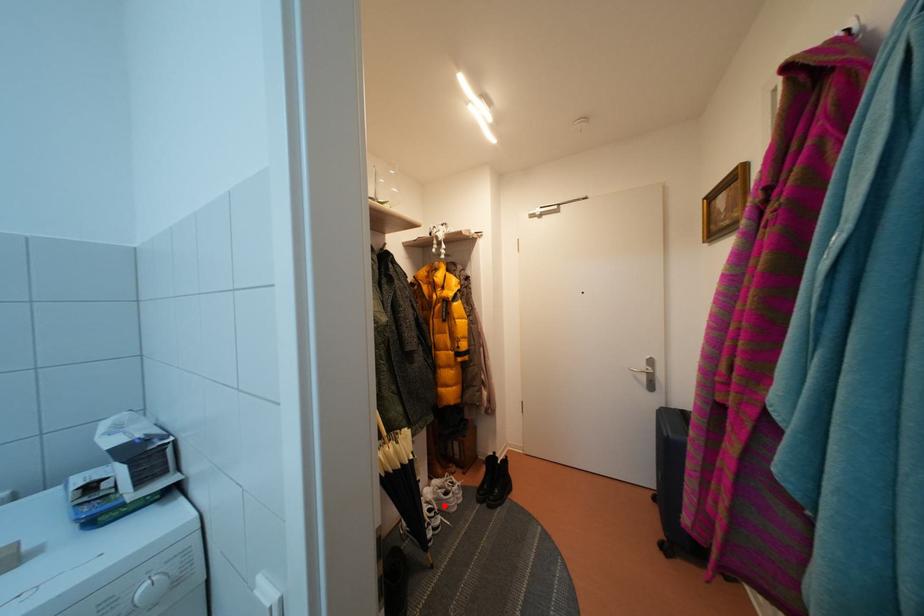
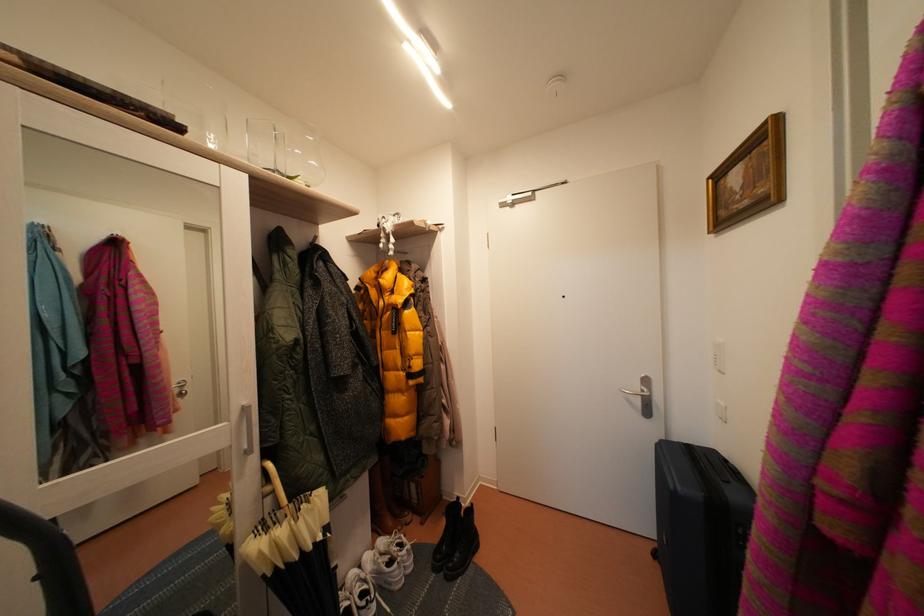
The point at the highlighted location is marked in the first image. Where is the corresponding point in the second image?

(384, 578)